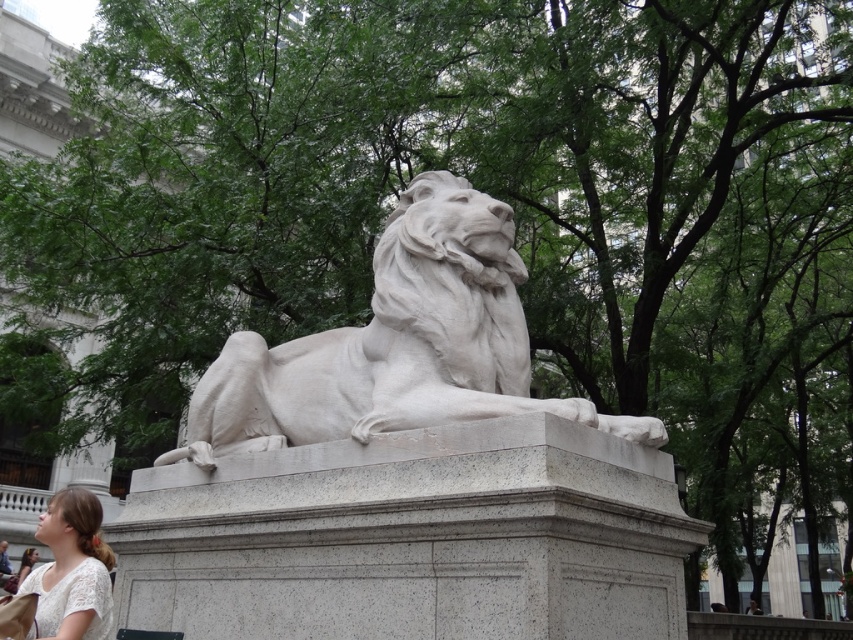
You are an art conservator examining the sculpture. You need to determine if the light brown hair at lower left is taller than the white marble lion at center. Based on the scene, what is your conclusion?

The white marble lion at center is much taller than the light brown hair at lower left, so the light brown hair at lower left is not taller than the white marble lion at center.

You are standing in front of the stone sculpture of a reclining lion on the pedestal. You notice two points marked on the ground at coordinates point [93,499] and point [22,557]. Which point is closer to you?

Point [93,499] is in front of point [22,557], so it is closer to you.

Where is the white marble lion at center located in the image?

The white marble lion at center is located at point (396, 344).